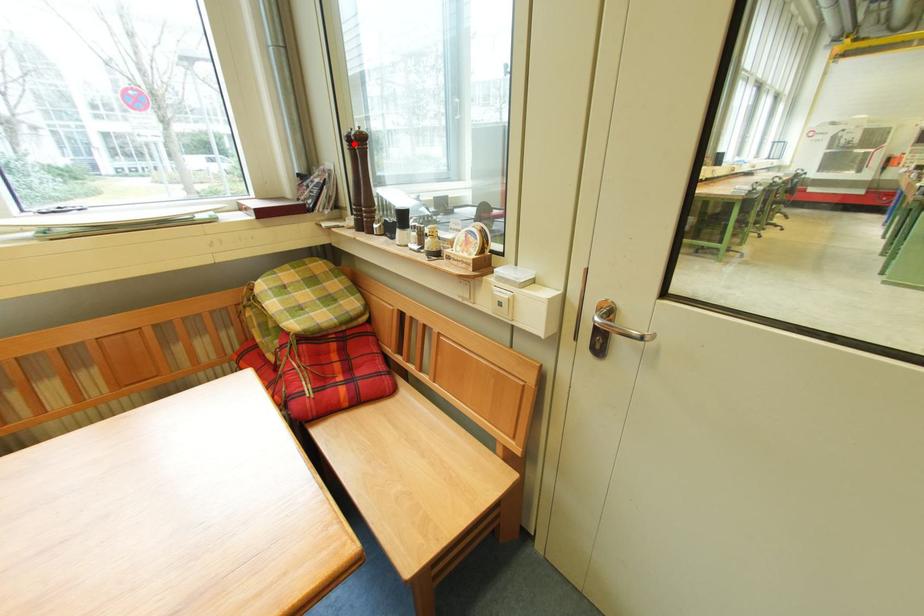
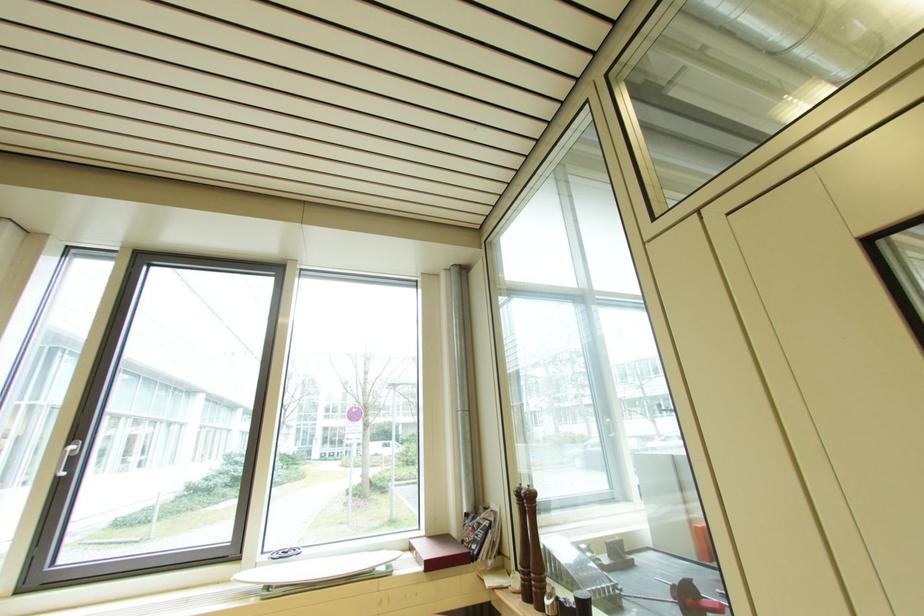
The point at the highlighted location is marked in the first image. Where is the corresponding point in the second image?

(524, 498)